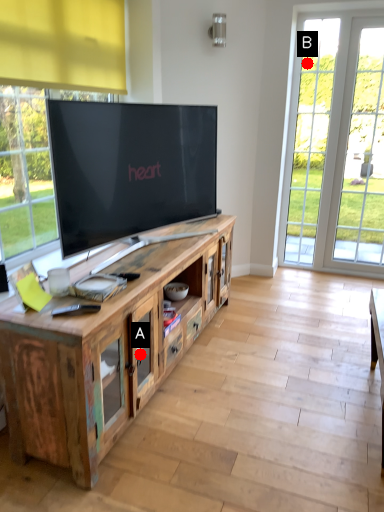
Question: Two points are circled on the image, labeled by A and B beside each circle. Which of the following is the farthest from the observer?

Choices:
 (A) A is further
 (B) B is further

Answer: (B)